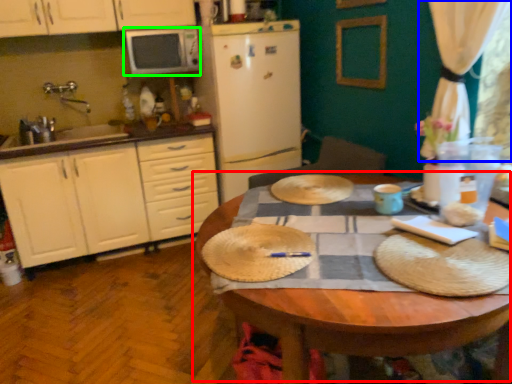
Question: Based on their relative distances, which object is nearer to table (highlighted by a red box)? Choose from curtain (highlighted by a blue box) and microwave oven (highlighted by a green box).

Choices:
 (A) curtain
 (B) microwave oven

Answer: (A)